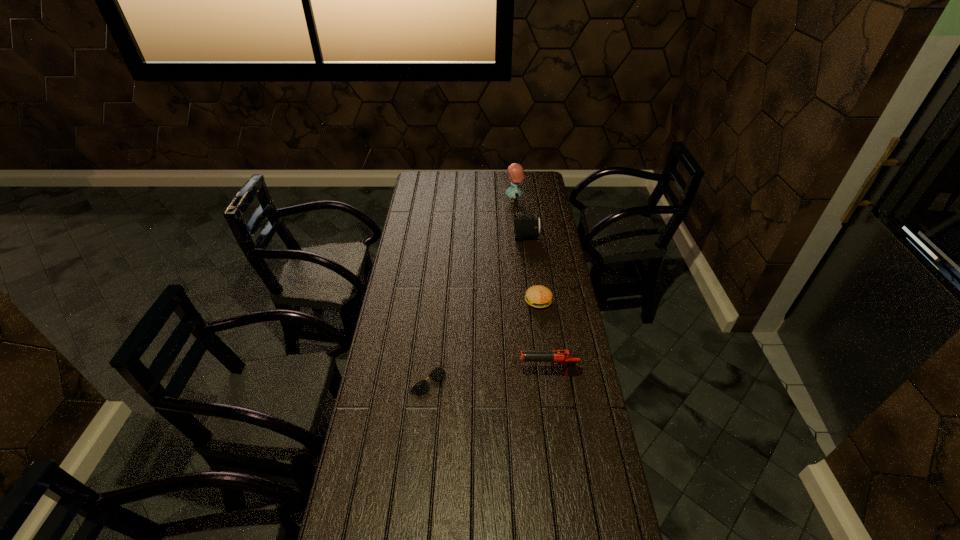
This screenshot has height=540, width=960. What are the coordinates of `object located at the left edge` in the screenshot? It's located at (421, 387).

The height and width of the screenshot is (540, 960). What are the coordinates of `doll that is positioned at the right edge` in the screenshot? It's located at (516, 173).

Locate an element on the screen. This screenshot has width=960, height=540. telephoto lens that is positioned at the right edge is located at coordinates (526, 225).

What are the coordinates of `gun at the right edge` in the screenshot? It's located at (564, 357).

Image resolution: width=960 pixels, height=540 pixels. In order to click on patty that is at the right edge in this screenshot , I will do `click(538, 296)`.

At what (x,y) coordinates should I click in order to perform the action: click on object that is at the far right corner. Please return your answer as a coordinate pair (x, y). The height and width of the screenshot is (540, 960). Looking at the image, I should click on (516, 173).

Where is `blank area at the far edge`? The image size is (960, 540). blank area at the far edge is located at coordinates (511, 181).

Where is `vacant area at the left edge of the desktop`? This screenshot has height=540, width=960. vacant area at the left edge of the desktop is located at coordinates (429, 267).

Locate an element on the screen. The image size is (960, 540). vacant space at the right edge of the desktop is located at coordinates (564, 280).

This screenshot has height=540, width=960. What are the coordinates of `vacant space at the far left corner of the desktop` in the screenshot? It's located at (413, 185).